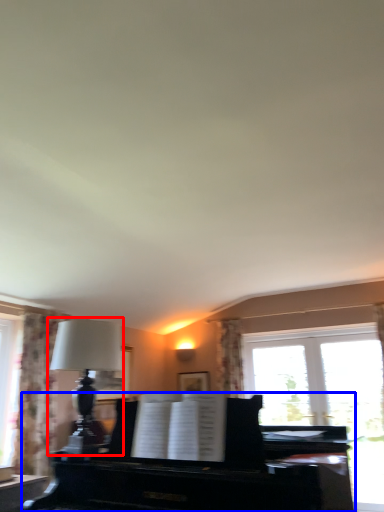
Question: Which of the following is the closest to the observer, table lamp (highlighted by a red box) or piano (highlighted by a blue box)?

Choices:
 (A) table lamp
 (B) piano

Answer: (B)